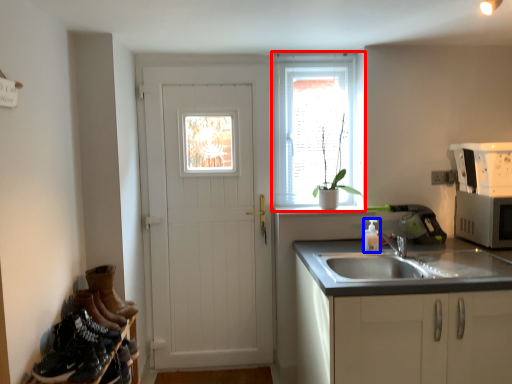
Question: Which point is closer to the camera, window (highlighted by a red box) or bottle (highlighted by a blue box)?

Choices:
 (A) window
 (B) bottle

Answer: (B)